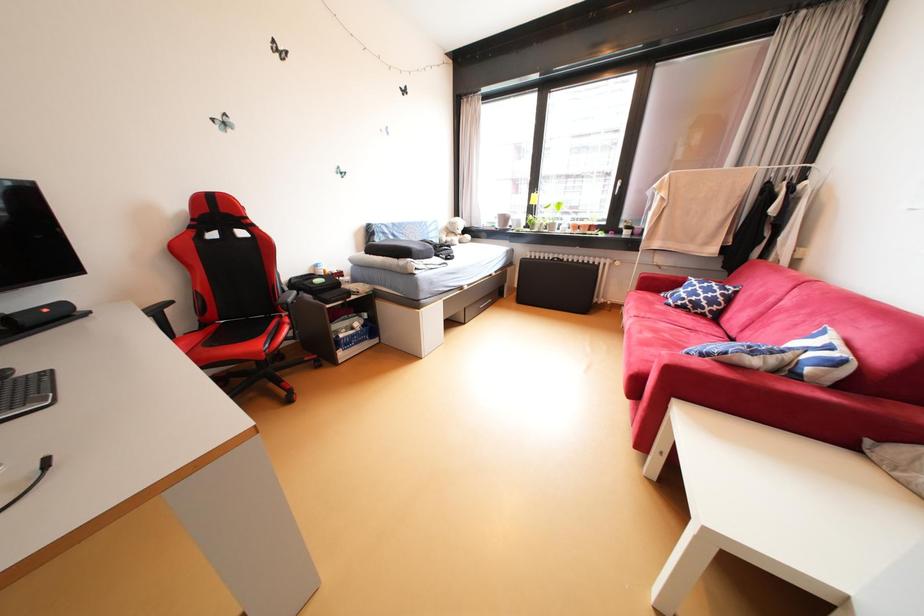
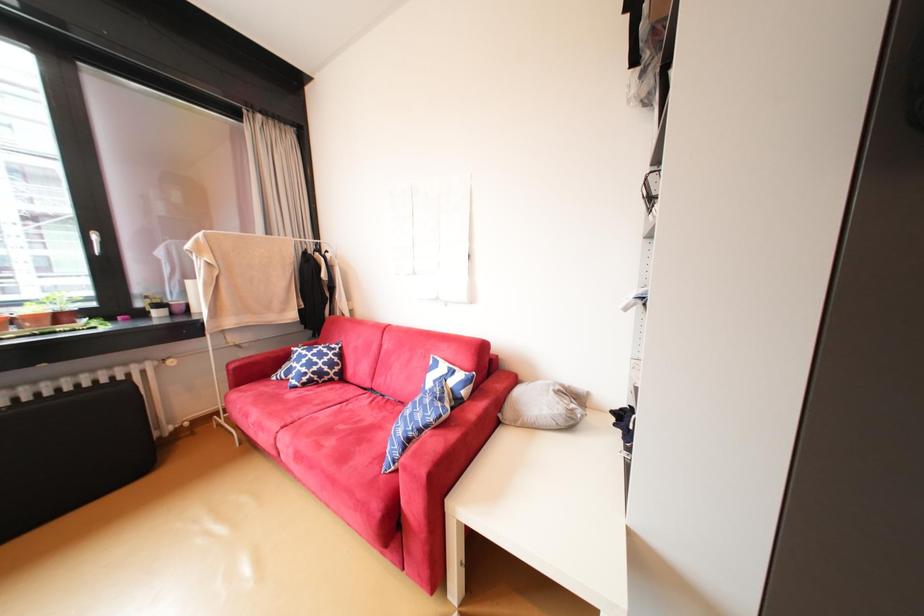
Question: The camera is either moving clockwise (left) or counter-clockwise (right) around the object. The first image is from the beginning of the video and the second image is from the end. Is the camera moving left or right when shooting the video?

Choices:
 (A) Left
 (B) Right

Answer: (A)